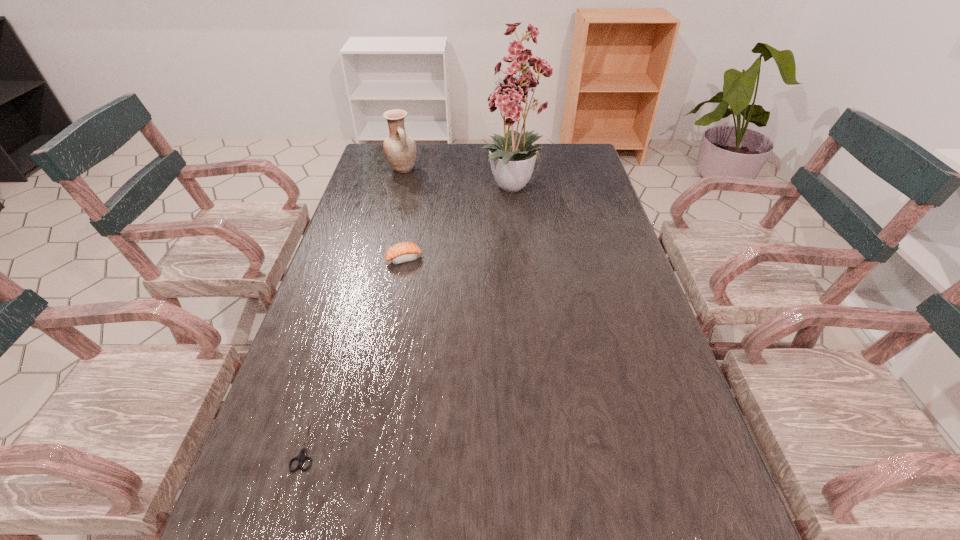
Image resolution: width=960 pixels, height=540 pixels. I want to click on flower arrangement, so click(511, 159).

This screenshot has width=960, height=540. I want to click on the fourth shortest object, so click(x=400, y=149).

Image resolution: width=960 pixels, height=540 pixels. What are the coordinates of `the third farthest object` in the screenshot? It's located at (403, 252).

At what (x,y) coordinates should I click in order to perform the action: click on sushi. Please return your answer as a coordinate pair (x, y). Image resolution: width=960 pixels, height=540 pixels. Looking at the image, I should click on (403, 252).

The height and width of the screenshot is (540, 960). I want to click on the second shortest object, so click(302, 456).

This screenshot has height=540, width=960. I want to click on the left shears, so click(x=302, y=456).

At what (x,y) coordinates should I click in order to perform the action: click on free space located on the front-facing side of the tallest object. Please return your answer as a coordinate pair (x, y). Image resolution: width=960 pixels, height=540 pixels. Looking at the image, I should click on (521, 248).

The width and height of the screenshot is (960, 540). Identify the location of free space located on the right of the pottery. (449, 170).

You are a GUI agent. You are given a task and a screenshot of the screen. Output one action in this format:
    pyautogui.click(x=<x>, y=<y>)
    Task: Click on the vacant space located 0.350m on the front of the third tallest object
    
    Given the screenshot: What is the action you would take?
    click(x=382, y=375)

Image resolution: width=960 pixels, height=540 pixels. What are the coordinates of `free space located 0.120m on the right of the taller shears` in the screenshot? It's located at (382, 442).